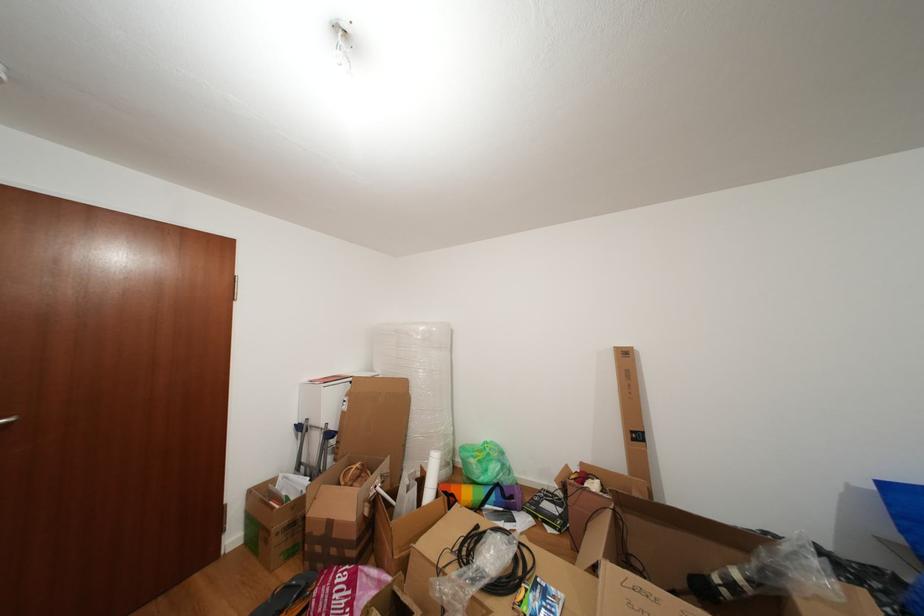
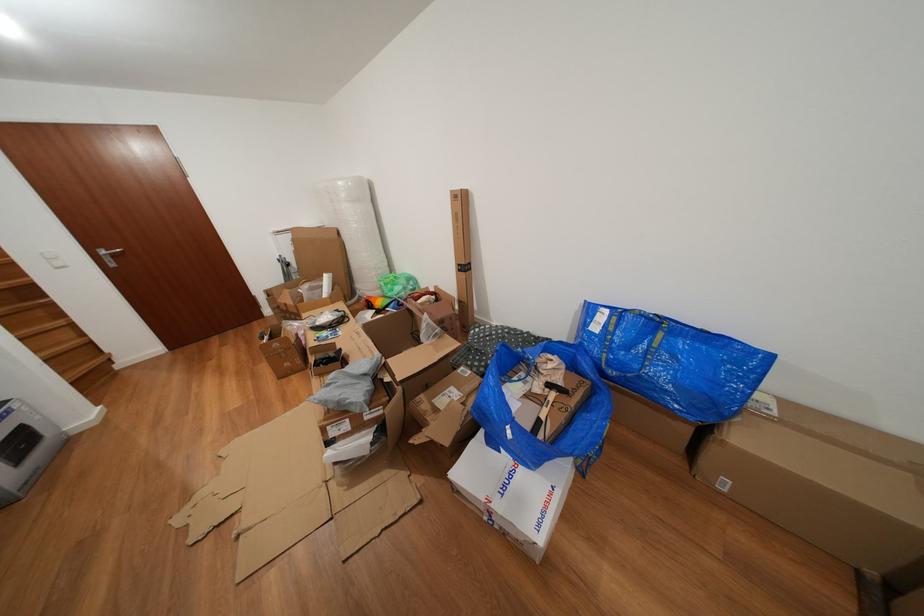
Find the pixel in the second image that matches (502,503) in the first image.

(399, 310)